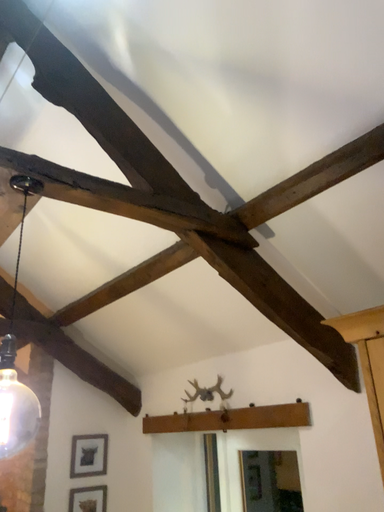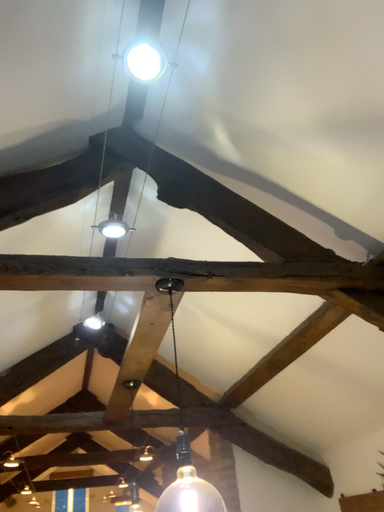
Question: How did the camera likely rotate when shooting the video?

Choices:
 (A) rotated left
 (B) rotated right

Answer: (A)